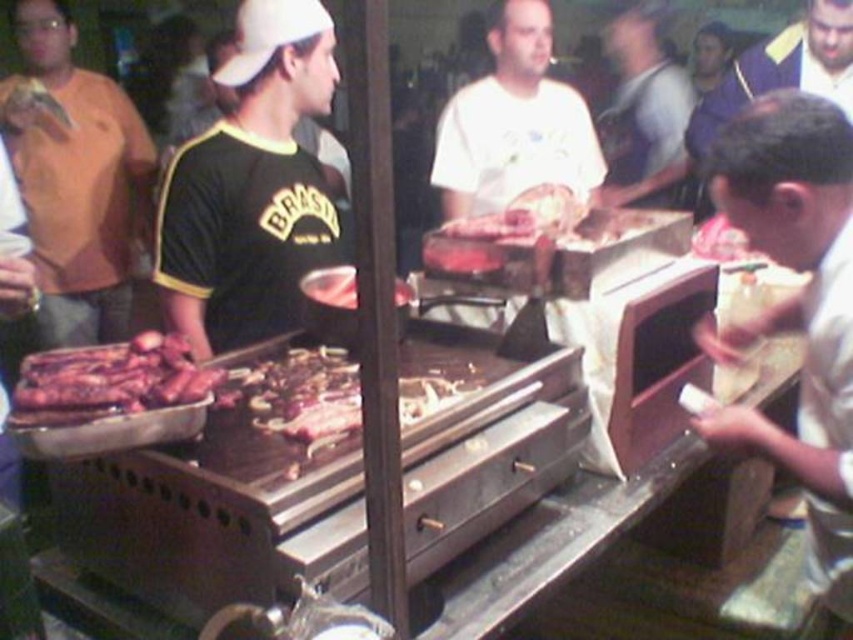
Between matte orange shirt at left and shiny brown ribs at left, which one has more height?

matte orange shirt at left

Can you confirm if matte orange shirt at left is thinner than shiny brown ribs at left?

In fact, matte orange shirt at left might be wider than shiny brown ribs at left.

Does point (20, 28) lie behind point (68, 397)?

That is True.

Identify the location of matte orange shirt at left. (74, 179).

Who is more forward, [49,424] or [682,83]?

Positioned in front is point [49,424].

Which is in front, point (134, 385) or point (621, 36)?

Positioned in front is point (134, 385).

Where is `shiny brown ribs at left`? This screenshot has height=640, width=853. shiny brown ribs at left is located at coordinates [109, 380].

Is white shirt at right smaller than shiny brown ribs at left?

No, white shirt at right is not smaller than shiny brown ribs at left.

Can you confirm if white shirt at right is thinner than shiny brown ribs at left?

Incorrect, white shirt at right's width is not less than shiny brown ribs at left's.

Between point (843, 134) and point (16, 417), which one is positioned behind?

The point (843, 134) is more distant.

Image resolution: width=853 pixels, height=640 pixels. I want to click on white shirt at right, so click(796, 305).